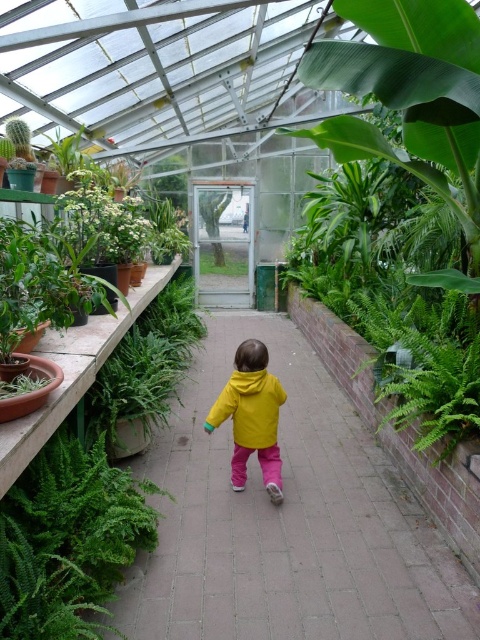
You are standing in the greenhouse and see the yellow fabric at center and the yellow matte jacket at center. Which one is nearer to you?

The yellow fabric at center is closer to the viewer than the yellow matte jacket at center.

You are standing in the greenhouse and want to reach the point marked as point (137, 608). The greenhouse has a walkway that is 8 feet wide. Can you safely walk to that point without crossing the walkway?

The point (137, 608) is 7.08 feet away from the viewer. Since the walkway is 8 feet wide, you can safely walk to that point without crossing the walkway as the distance is within the walkway width.

You are a visitor in the greenhouse and see both the yellow fabric at center and the yellow matte jacket at center. Which one is positioned more to the right side from your perspective?

The yellow fabric at center is positioned more to the right side from your perspective because it is to the right of the yellow matte jacket at center.